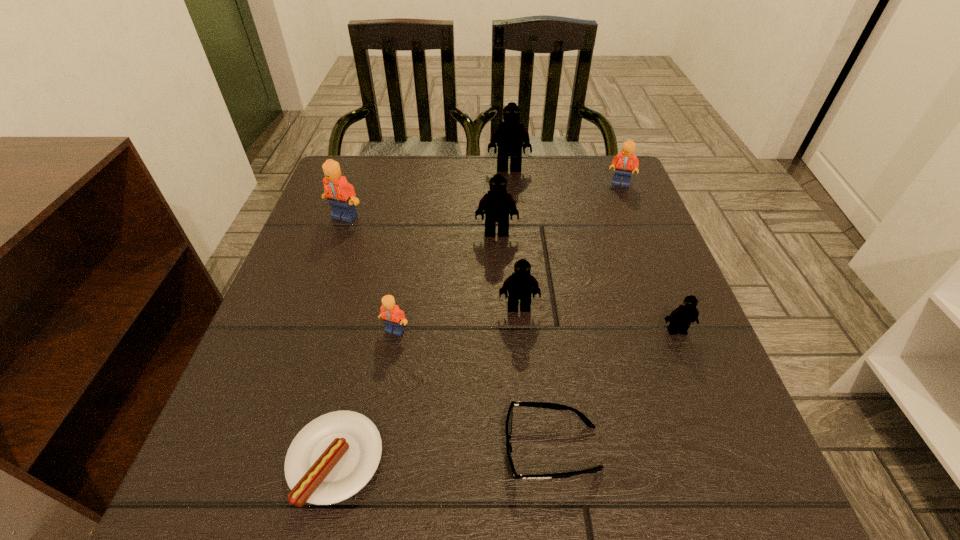
In order to click on the closest object to the biggest orange Lego in this screenshot , I will do `click(496, 204)`.

Choose which Lego is the second nearest neighbor to the third farthest black Lego. Please provide its 2D coordinates. Your answer should be formatted as a tuple, i.e. [(x, y)], where the tuple contains the x and y coordinates of a point satisfying the conditions above.

[(496, 204)]

Locate which Lego ranks second in proximity to the nearest orange Lego. Please provide its 2D coordinates. Your answer should be formatted as a tuple, i.e. [(x, y)], where the tuple contains the x and y coordinates of a point satisfying the conditions above.

[(496, 204)]

Locate which black Lego is the third closest to the sausage. Please provide its 2D coordinates. Your answer should be formatted as a tuple, i.e. [(x, y)], where the tuple contains the x and y coordinates of a point satisfying the conditions above.

[(680, 318)]

Identify the location of black Lego that stands as the third closest to the rightmost orange Lego. (521, 285).

You are a GUI agent. You are given a task and a screenshot of the screen. Output one action in this format:
    pyautogui.click(x=<x>, y=<y>)
    Task: Click on the orange Lego that is the closest to the fifth nearest Lego
    The height and width of the screenshot is (540, 960).
    Given the screenshot: What is the action you would take?
    pyautogui.click(x=393, y=317)

Find the location of a particular element. This screenshot has width=960, height=540. the second closest orange Lego to the third smallest black Lego is located at coordinates (393, 317).